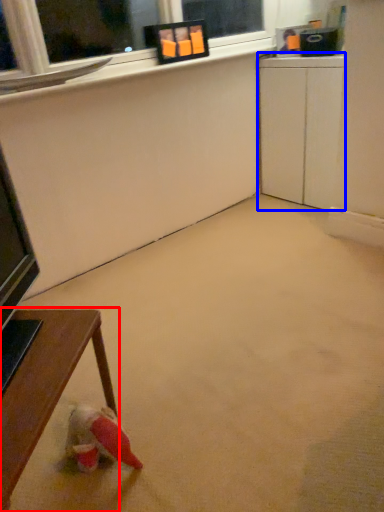
Question: Which point is closer to the camera, table (highlighted by a red box) or computer desk (highlighted by a blue box)?

Choices:
 (A) table
 (B) computer desk

Answer: (A)